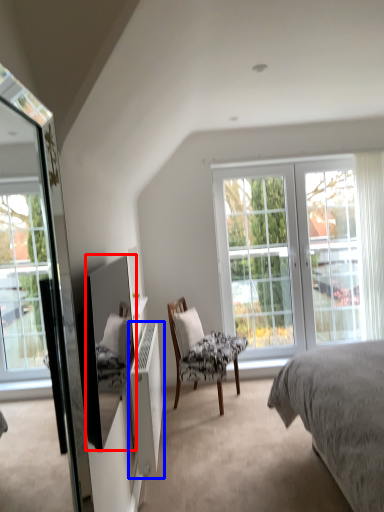
Question: Which of the following is the closest to the observer, mirror (highlighted by a red box) or radiator (highlighted by a blue box)?

Choices:
 (A) mirror
 (B) radiator

Answer: (A)